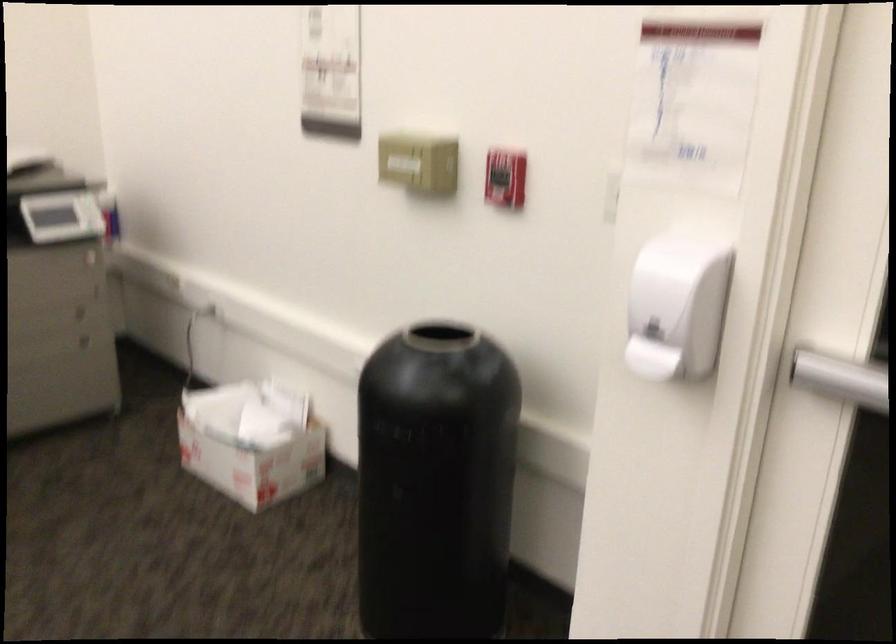
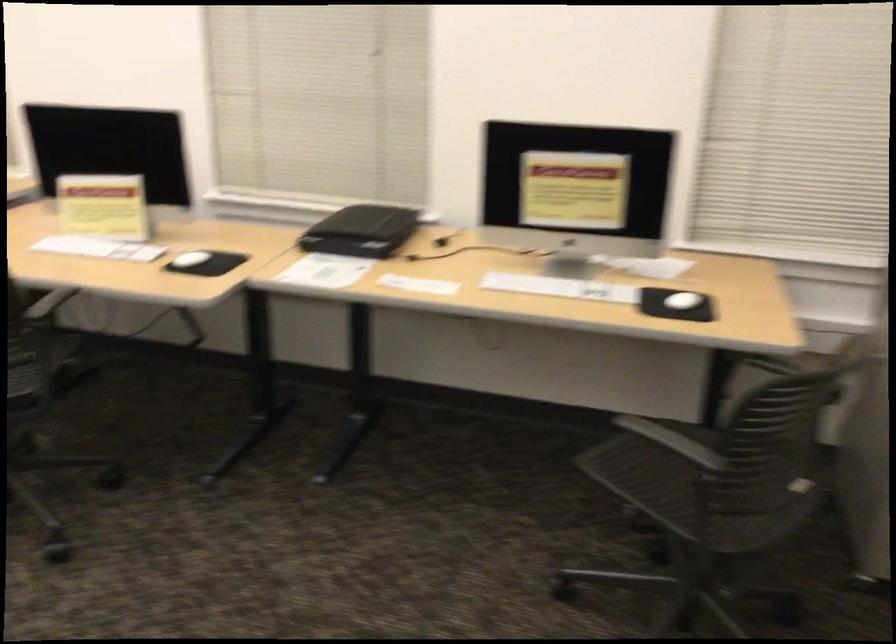
Question: How did the camera likely rotate?

Choices:
 (A) Left
 (B) Right
 (C) Up
 (D) Down

Answer: (A)